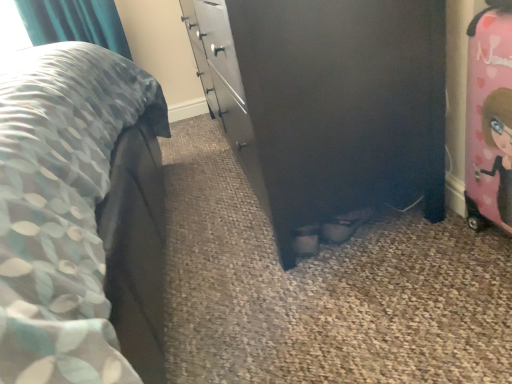
At what (x,y) coordinates should I click in order to perform the action: click on pink glossy suitcase at right. Please return your answer as a coordinate pair (x, y). Looking at the image, I should click on (490, 117).

Measure the distance between point (470,108) and camera.

A distance of 37.01 inches exists between point (470,108) and camera.

What do you see at coordinates (490, 117) in the screenshot? I see `pink glossy suitcase at right` at bounding box center [490, 117].

The height and width of the screenshot is (384, 512). I want to click on black matte chest of drawers at center, so click(328, 107).

The height and width of the screenshot is (384, 512). What do you see at coordinates (328, 107) in the screenshot? I see `black matte chest of drawers at center` at bounding box center [328, 107].

Locate an element on the screen. pink glossy suitcase at right is located at coordinates (490, 117).

Can you confirm if pink glossy suitcase at right is positioned to the left of black matte chest of drawers at center?

No.

Who is more distant, pink glossy suitcase at right or black matte chest of drawers at center?

Positioned behind is black matte chest of drawers at center.

Is point (476, 230) closer or farther from the camera than point (385, 141)?

Clearly, point (476, 230) is more distant from the camera than point (385, 141).

From the image's perspective, which one is positioned higher, pink glossy suitcase at right or black matte chest of drawers at center?

black matte chest of drawers at center is shown above in the image.

From a real-world perspective, who is located lower, pink glossy suitcase at right or black matte chest of drawers at center?

In real-world perspective, pink glossy suitcase at right is lower.

Based on the photo, which object is wider, pink glossy suitcase at right or black matte chest of drawers at center?

With larger width is black matte chest of drawers at center.

Can you confirm if pink glossy suitcase at right is shorter than black matte chest of drawers at center?

Indeed, pink glossy suitcase at right has a lesser height compared to black matte chest of drawers at center.

Does pink glossy suitcase at right have a larger size compared to black matte chest of drawers at center?

Actually, pink glossy suitcase at right might be smaller than black matte chest of drawers at center.

Based on the photo, is black matte chest of drawers at center surrounded by pink glossy suitcase at right?

No, black matte chest of drawers at center is not a part of pink glossy suitcase at right.

Is pink glossy suitcase at right not close to black matte chest of drawers at center?

No, there isn't a large distance between pink glossy suitcase at right and black matte chest of drawers at center.

Could you tell me if pink glossy suitcase at right is turned towards black matte chest of drawers at center?

No, pink glossy suitcase at right is not turned towards black matte chest of drawers at center.

Can you tell me how much pink glossy suitcase at right and black matte chest of drawers at center differ in facing direction?

pink glossy suitcase at right and black matte chest of drawers at center are facing 0.356 degrees away from each other.

You are a GUI agent. You are given a task and a screenshot of the screen. Output one action in this format:
    pyautogui.click(x=<x>, y=<y>)
    Task: Click on the chest of drawers located above the pink glossy suitcase at right (from a real-world perspective)
    This screenshot has height=384, width=512.
    Given the screenshot: What is the action you would take?
    pyautogui.click(x=328, y=107)

Considering the relative positions of black matte chest of drawers at center and pink glossy suitcase at right in the image provided, is black matte chest of drawers at center to the left of pink glossy suitcase at right from the viewer's perspective?

Yes, black matte chest of drawers at center is to the left of pink glossy suitcase at right.

Who is more distant, black matte chest of drawers at center or pink glossy suitcase at right?

Positioned behind is black matte chest of drawers at center.

Which is less distant, (203, 26) or (490, 88)?

Clearly, point (203, 26) is more distant from the camera than point (490, 88).

From the image's perspective, would you say black matte chest of drawers at center is shown under pink glossy suitcase at right?

Actually, black matte chest of drawers at center appears above pink glossy suitcase at right in the image.

From a real-world perspective, is black matte chest of drawers at center positioned above or below pink glossy suitcase at right?

black matte chest of drawers at center is above pink glossy suitcase at right.

Which object is wider, black matte chest of drawers at center or pink glossy suitcase at right?

black matte chest of drawers at center.

In terms of height, does black matte chest of drawers at center look taller or shorter compared to pink glossy suitcase at right?

black matte chest of drawers at center is taller than pink glossy suitcase at right.

Is black matte chest of drawers at center bigger or smaller than pink glossy suitcase at right?

Considering their sizes, black matte chest of drawers at center takes up more space than pink glossy suitcase at right.

Is pink glossy suitcase at right a part of black matte chest of drawers at center?

No, pink glossy suitcase at right is not inside black matte chest of drawers at center.

Is black matte chest of drawers at center far away from pink glossy suitcase at right?

black matte chest of drawers at center is near pink glossy suitcase at right, not far away.

Could you tell me if black matte chest of drawers at center is turned towards pink glossy suitcase at right?

No.

Can you tell me how much black matte chest of drawers at center and pink glossy suitcase at right differ in facing direction?

The angle between the facing direction of black matte chest of drawers at center and the facing direction of pink glossy suitcase at right is 0.356 degrees.

Find the location of a particular element. chest of drawers that appears on the left of pink glossy suitcase at right is located at coordinates (328, 107).

Find the location of `chest of drawers above the pink glossy suitcase at right (from the image's perspective)`. chest of drawers above the pink glossy suitcase at right (from the image's perspective) is located at coordinates (328, 107).

I want to click on toy below the black matte chest of drawers at center (from the image's perspective), so click(x=490, y=117).